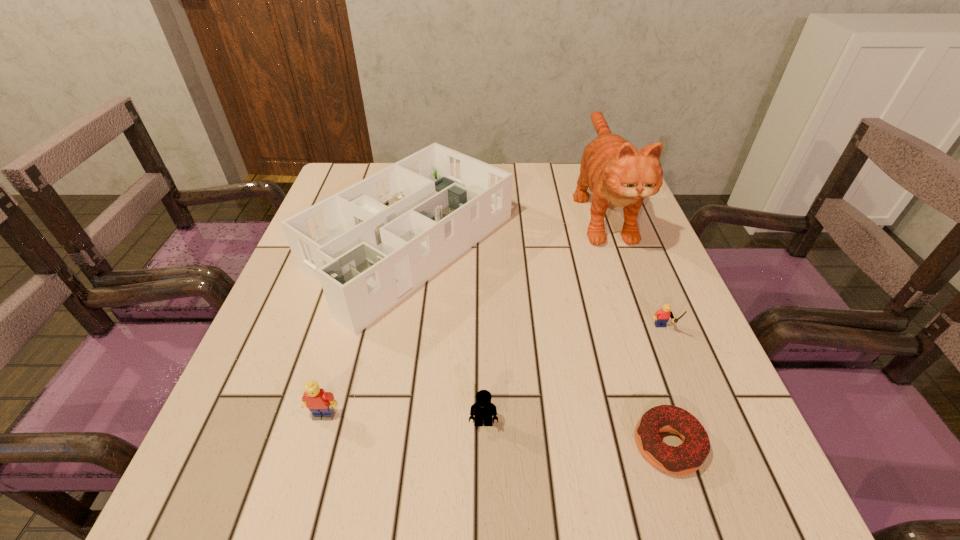
Find the location of `the tallest object`. the tallest object is located at coordinates (617, 174).

This screenshot has height=540, width=960. I want to click on the fifth shortest object, so click(x=372, y=244).

Locate an element on the screen. the leftmost Lego is located at coordinates (320, 403).

This screenshot has width=960, height=540. I want to click on the rightmost Lego, so click(662, 316).

Where is `the second Lego from right to left`? This screenshot has width=960, height=540. the second Lego from right to left is located at coordinates (483, 408).

Where is `the shortest object`? This screenshot has height=540, width=960. the shortest object is located at coordinates (688, 457).

Image resolution: width=960 pixels, height=540 pixels. I want to click on free spot located on the face of the tallest object, so click(x=650, y=346).

Identify the location of vacant area situated on the front of the dollhouse. (385, 383).

I want to click on vacant region located on the front-facing side of the leftmost Lego, so click(312, 456).

Locate an element on the screen. vacant region located on the front-facing side of the rightmost Lego is located at coordinates (675, 361).